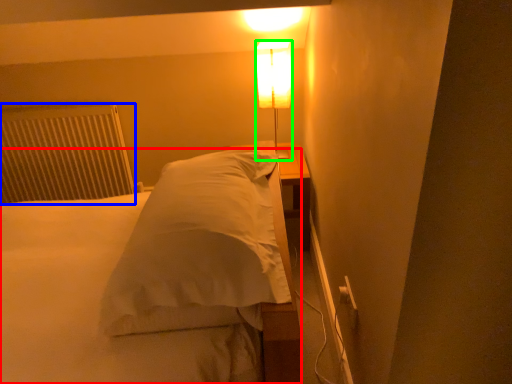
Question: Based on their relative distances, which object is farther from bed (highlighted by a red box)? Choose from radiator (highlighted by a blue box) and lamp (highlighted by a green box).

Choices:
 (A) radiator
 (B) lamp

Answer: (B)